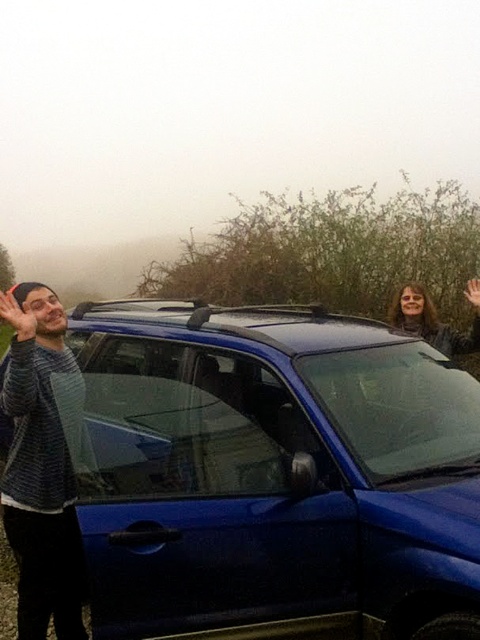
Question: Is blue glossy suv at center to the left of matte black hair at upper right from the viewer's perspective?

Choices:
 (A) no
 (B) yes

Answer: (B)

Question: Is striped sweater at left to the right of matte black hand at upper right from the viewer's perspective?

Choices:
 (A) no
 (B) yes

Answer: (A)

Question: Which object is the closest to the matte black hair at upper right?

Choices:
 (A) striped sweater at left
 (B) blue glossy suv at center
 (C) matte black hand at upper left
 (D) matte black hand at upper right

Answer: (D)

Question: Which object is the closest to the matte black hand at upper right?

Choices:
 (A) striped sweater at left
 (B) matte black hand at upper left

Answer: (B)

Question: Can you confirm if striped sweater at left is bigger than matte black hand at upper left?

Choices:
 (A) no
 (B) yes

Answer: (B)

Question: Which object is the closest to the blue glossy suv at center?

Choices:
 (A) matte black hair at upper right
 (B) matte black hand at upper right
 (C) matte black hand at upper left

Answer: (C)